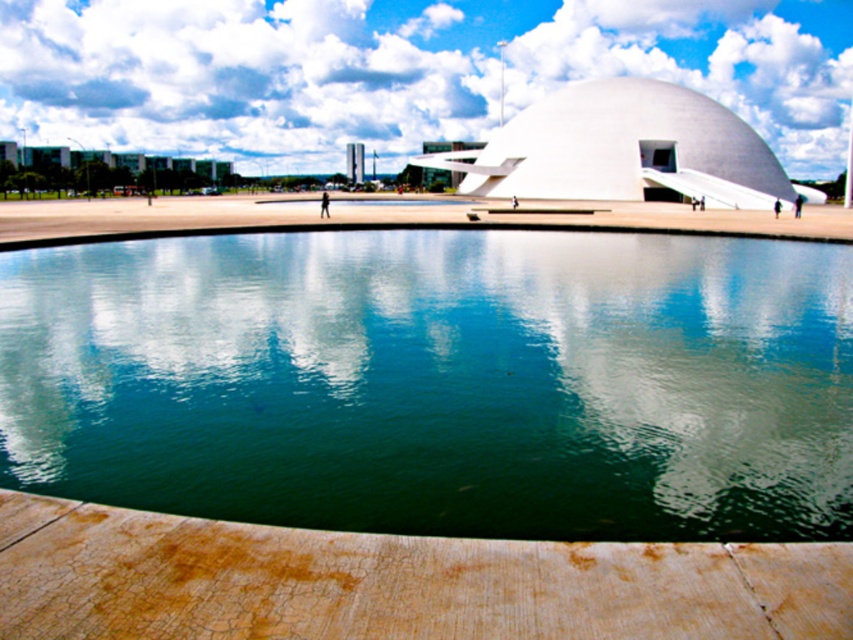
Question: Can you confirm if white cloud at upper center is positioned above white smooth dome at center?

Choices:
 (A) yes
 (B) no

Answer: (A)

Question: Estimate the real-world distances between objects in this image. Which object is closer to the white cloud at upper center?

Choices:
 (A) green smooth water at center
 (B) white smooth dome at center

Answer: (B)

Question: Among these points, which one is farthest from the camera?

Choices:
 (A) (543, 141)
 (B) (90, 19)
 (C) (3, 321)

Answer: (B)

Question: Is green smooth water at center closer to camera compared to white cloud at upper center?

Choices:
 (A) yes
 (B) no

Answer: (A)

Question: Does green smooth water at center come behind white cloud at upper center?

Choices:
 (A) yes
 (B) no

Answer: (B)

Question: Which object is farther from the camera taking this photo?

Choices:
 (A) green smooth water at center
 (B) white smooth dome at center

Answer: (B)